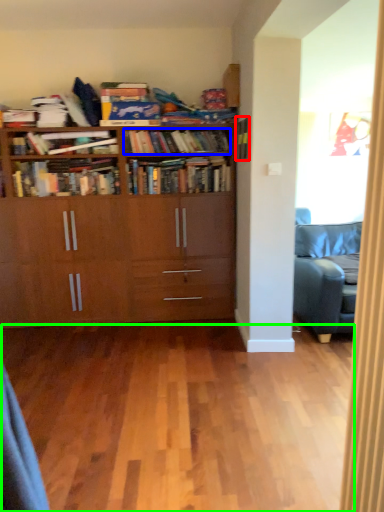
Question: Estimate the real-world distances between objects in this image. Which object is farther from book (highlighted by a red box), book (highlighted by a blue box) or plain (highlighted by a green box)?

Choices:
 (A) book
 (B) plain

Answer: (B)